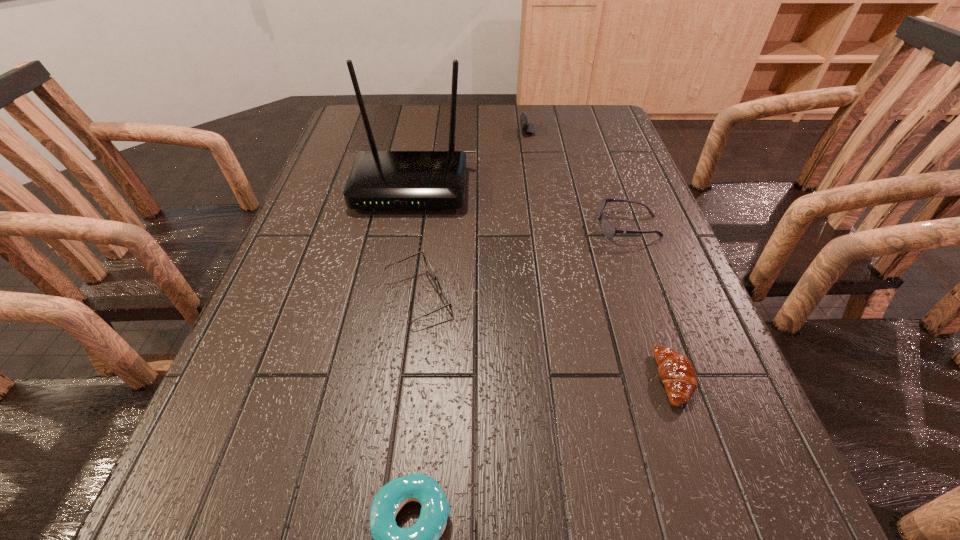
Identify the location of vacant space located on the lenses of the sunglasses. (441, 226).

The width and height of the screenshot is (960, 540). I want to click on vacant region located 0.290m on the lenses of the sunglasses, so click(474, 226).

This screenshot has width=960, height=540. I want to click on free location located 0.190m on the lenses of the sunglasses, so click(x=517, y=226).

Where is `free space located on the back of the crescent roll`? This screenshot has width=960, height=540. free space located on the back of the crescent roll is located at coordinates (626, 240).

Locate an element on the screen. This screenshot has height=540, width=960. object positioned at the far edge is located at coordinates (528, 127).

This screenshot has width=960, height=540. Find the location of `object at the left edge`. object at the left edge is located at coordinates (378, 179).

At what (x,y) coordinates should I click in order to perform the action: click on webcam located at the right edge. Please return your answer as a coordinate pair (x, y). Looking at the image, I should click on pyautogui.click(x=528, y=127).

I want to click on sunglasses at the right edge, so click(608, 229).

Locate an element on the screen. This screenshot has height=540, width=960. crescent roll situated at the right edge is located at coordinates (676, 372).

Where is `object positioned at the far right corner`? This screenshot has width=960, height=540. object positioned at the far right corner is located at coordinates (528, 127).